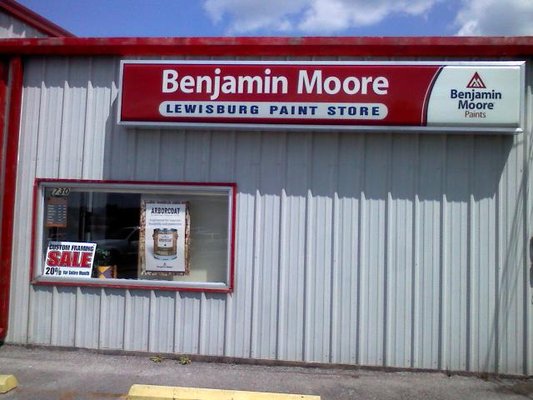
Where is `window`? window is located at coordinates 113,224.